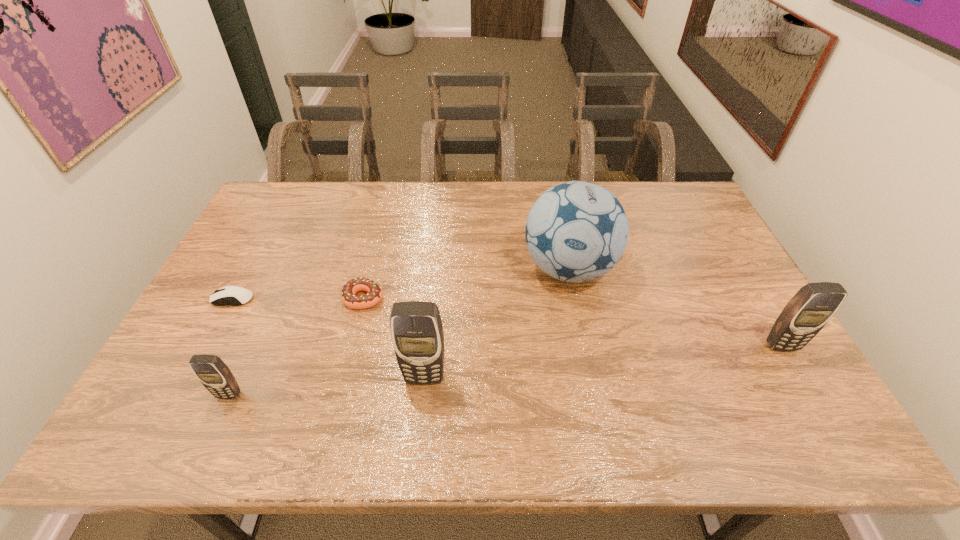
Where is `the third object from left to right`? The height and width of the screenshot is (540, 960). the third object from left to right is located at coordinates (350, 288).

The height and width of the screenshot is (540, 960). Identify the location of free space located 0.080m on the front face of the rightmost cellular telephone. coord(803,381).

The height and width of the screenshot is (540, 960). Find the location of `vacant region located 0.080m on the front of the shortest object`. vacant region located 0.080m on the front of the shortest object is located at coordinates (217, 330).

This screenshot has height=540, width=960. I want to click on blank space located 0.220m on the side with brand of the soccer ball, so click(589, 372).

Find the location of `free region located on the right of the fifth tallest object`. free region located on the right of the fifth tallest object is located at coordinates (419, 298).

Where is `cellular telephone located at the left edge`? The image size is (960, 540). cellular telephone located at the left edge is located at coordinates point(212,372).

This screenshot has height=540, width=960. Find the location of `mouse situated at the left edge`. mouse situated at the left edge is located at coordinates (241, 296).

You are a GUI agent. You are given a task and a screenshot of the screen. Output one action in this format:
    pyautogui.click(x=<x>, y=<y>)
    Task: Click on the object located in the right edge section of the desktop
    The image size is (960, 540).
    Given the screenshot: What is the action you would take?
    (810, 309)

This screenshot has height=540, width=960. I want to click on object present at the near left corner, so click(212, 372).

In the image, there is a desktop. Identify the location of vacant space at the far edge. (390, 189).